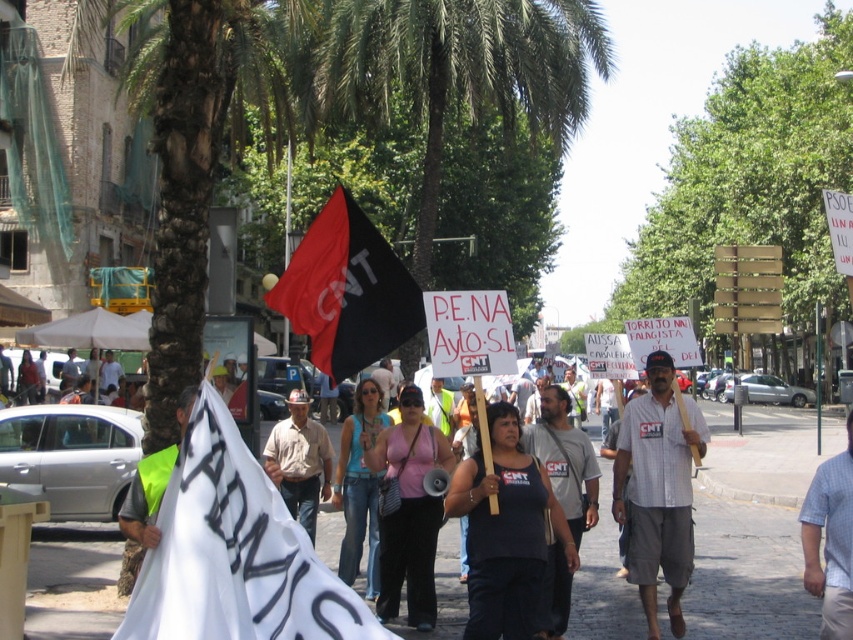
Looking at this image, does black cotton tank top at center appear over black matte flag at center?

No, black cotton tank top at center is not above black matte flag at center.

Between black cotton tank top at center and black matte flag at center, which one is positioned lower?

black cotton tank top at center

Find the location of a particular element. The width and height of the screenshot is (853, 640). black cotton tank top at center is located at coordinates (506, 531).

Does white cotton shirt at center have a larger size compared to pink fabric tank top at center?

Indeed, white cotton shirt at center has a larger size compared to pink fabric tank top at center.

Which is behind, point (671, 406) or point (428, 436)?

The point (428, 436) is behind.

Does point (646, 500) come closer to viewer compared to point (410, 406)?

Yes, point (646, 500) is closer to viewer.

I want to click on white cotton shirt at center, so click(659, 488).

Is white cotton shirt at center further to camera compared to light blue checkered shirt at center?

That is True.

Locate an element on the screen. white cotton shirt at center is located at coordinates (659, 488).